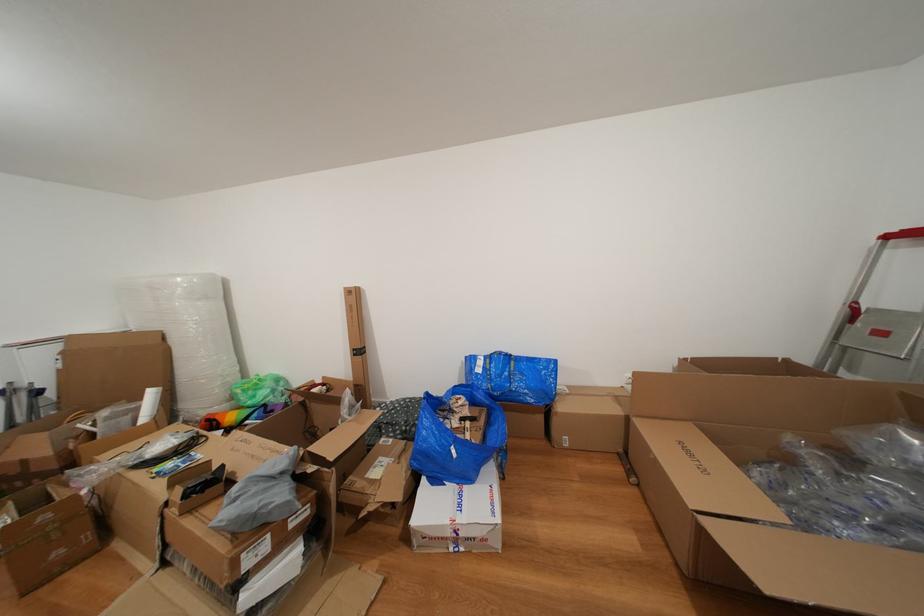
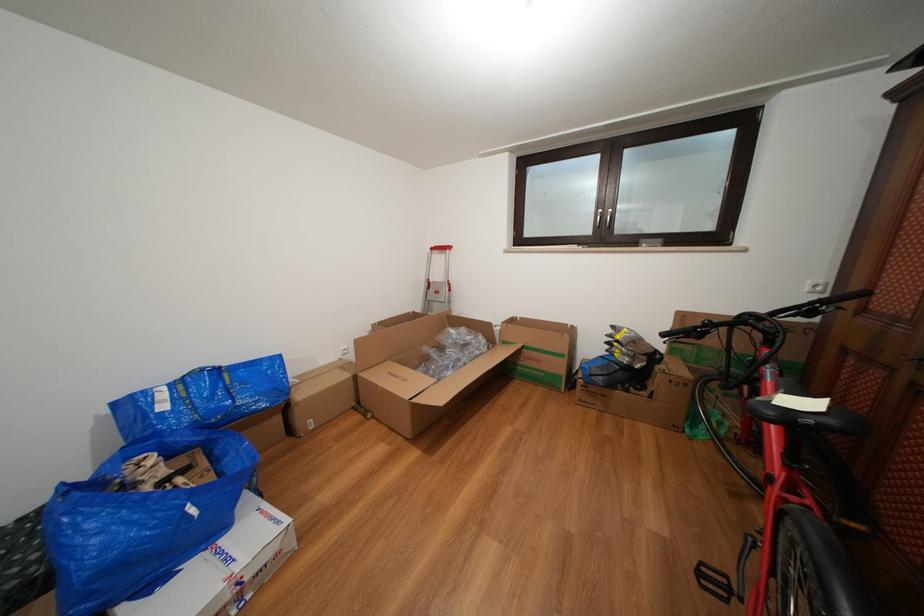
Find the pixel in the second image that matches the point at 462,456 in the first image.

(201, 516)